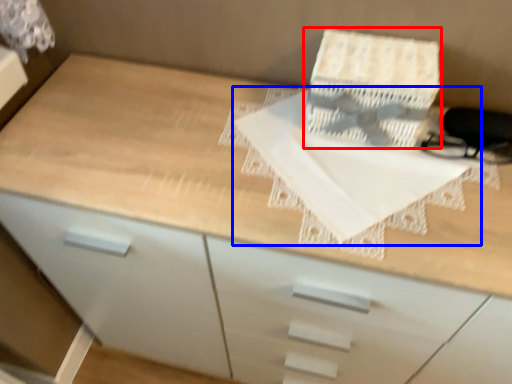
Question: Which object is closer to the camera taking this photo, cardboard box (highlighted by a red box) or sheet (highlighted by a blue box)?

Choices:
 (A) cardboard box
 (B) sheet

Answer: (B)